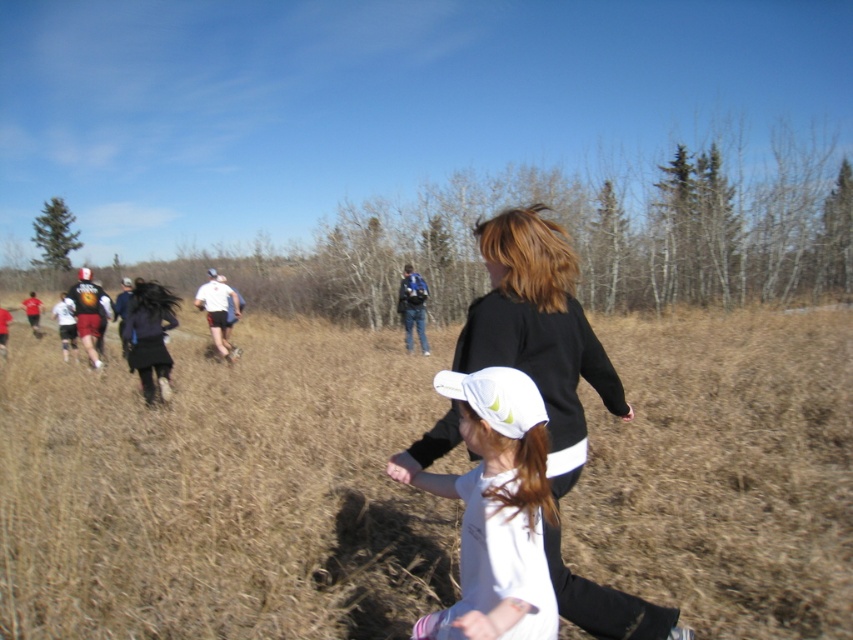
You are a photographer trying to capture a clear shot of the black matte jacket at center and the matte blue backpack at center in the image. Since both are at the same central position, which one will appear bigger in your photo?

The black matte jacket at center will appear bigger in the photo because it is larger in size than the matte blue backpack at center.

You are a photographer trying to capture the scene. You notice the black matte jacket at center and the matte blue backpack at center. Which object should you focus on to ensure both are in the frame without moving the camera?

You should focus on the black matte jacket at center because it is positioned below the matte blue backpack at center, so keeping the jacket in the lower part of the frame will naturally include the backpack above it.

You are a photographer trying to capture the young girl in the white matte dress at center and the adult in white matte shorts at center. Based on their positions, which clothing item is lower in the image?

The white matte dress at center is below white matte shorts at center, so the dress is lower in the image.